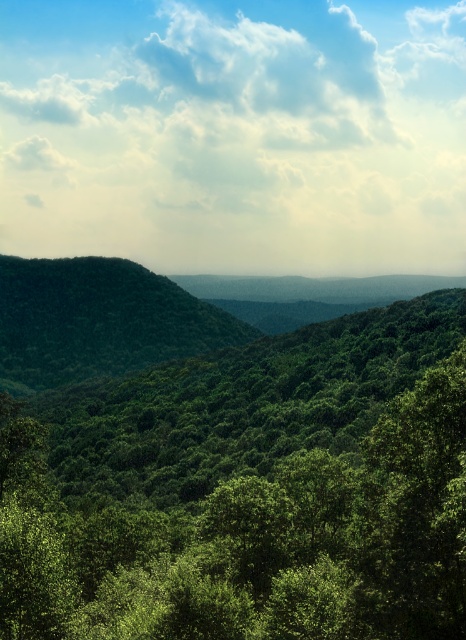
Is point (20, 451) farther from viewer compared to point (117, 364)?

No, (20, 451) is closer to viewer.

Consider the image. Can you confirm if green leafy tree at center is wider than green leafy hill at center?

In fact, green leafy tree at center might be narrower than green leafy hill at center.

Locate an element on the screen. green leafy tree at center is located at coordinates (247, 490).

Where is `green leafy tree at center`? Image resolution: width=466 pixels, height=640 pixels. green leafy tree at center is located at coordinates (247, 490).